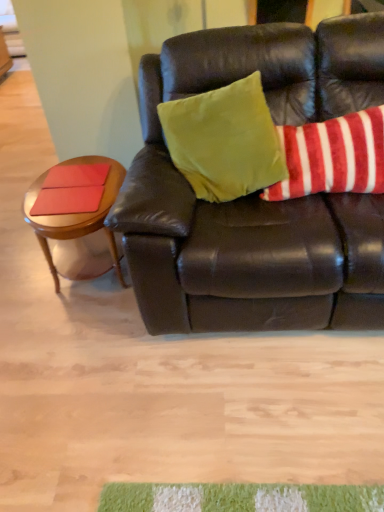
Find the location of `empty space that is ontop of matte red pad at left, the second pad from the bottom (from a real-world perspective)`. empty space that is ontop of matte red pad at left, the second pad from the bottom (from a real-world perspective) is located at coordinates (77, 172).